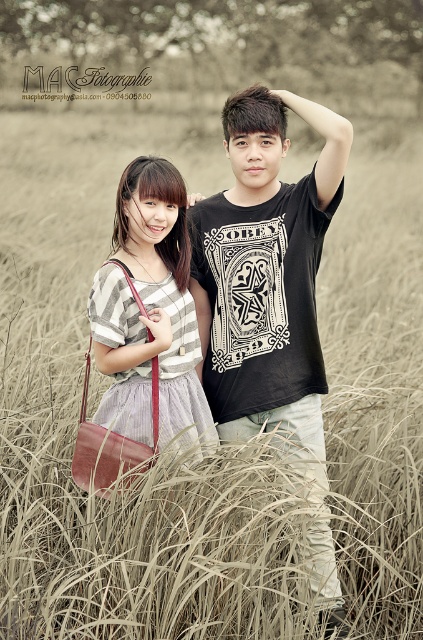
Question: Which object is closer to the camera taking this photo?

Choices:
 (A) matte striped shirt at center
 (B) black cotton t-shirt at center

Answer: (B)

Question: Does black cotton t-shirt at center come in front of matte striped shirt at center?

Choices:
 (A) no
 (B) yes

Answer: (B)

Question: Is black cotton t-shirt at center to the left of matte striped shirt at center from the viewer's perspective?

Choices:
 (A) no
 (B) yes

Answer: (A)

Question: Can you confirm if black cotton t-shirt at center is positioned above matte striped shirt at center?

Choices:
 (A) no
 (B) yes

Answer: (A)

Question: Which point is closer to the camera taking this photo?

Choices:
 (A) (120, 385)
 (B) (323, 566)

Answer: (A)